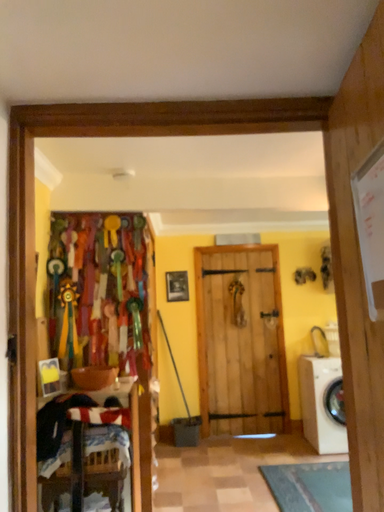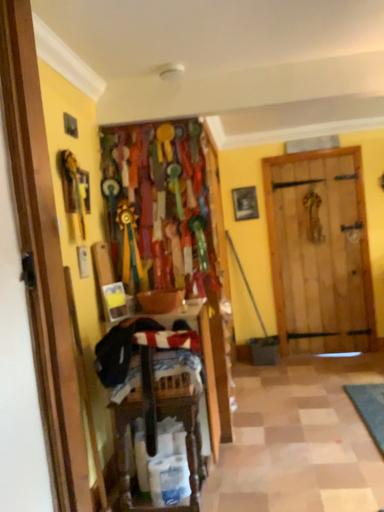
Question: How did the camera likely rotate when shooting the video?

Choices:
 (A) rotated right
 (B) rotated left

Answer: (B)